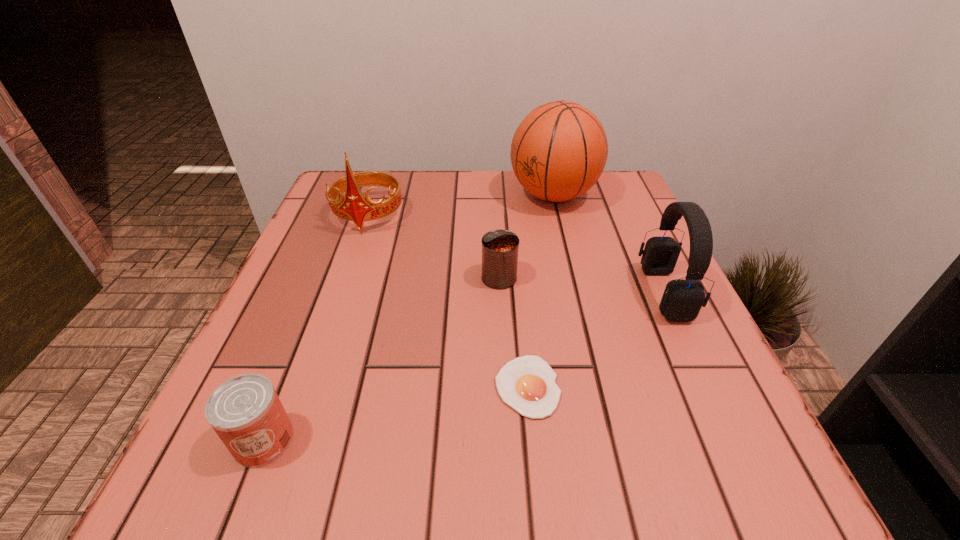
Where is `can at the left edge`? can at the left edge is located at coordinates (246, 413).

What are the coordinates of `basketball situated at the right edge` in the screenshot? It's located at 558,152.

The height and width of the screenshot is (540, 960). I want to click on headset that is at the right edge, so click(682, 299).

Where is `object that is at the far left corner`? object that is at the far left corner is located at coordinates (355, 207).

Locate an element on the screen. The width and height of the screenshot is (960, 540). object at the near left corner is located at coordinates (246, 413).

Where is `object located at the far right corner`? object located at the far right corner is located at coordinates (558, 152).

I want to click on vacant area at the far edge of the desktop, so click(x=461, y=171).

Find the location of `free location at the near edge`. free location at the near edge is located at coordinates (450, 496).

Locate an element on the screen. free space at the left edge is located at coordinates [319, 227].

This screenshot has width=960, height=540. In the image, there is a desktop. What are the coordinates of `vacant region at the right edge` in the screenshot? It's located at (615, 224).